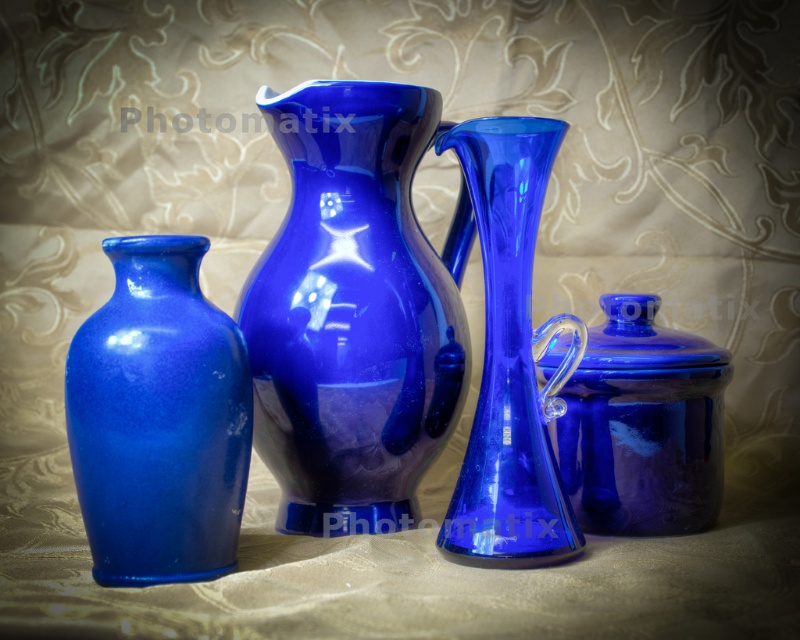
Does glossy ceramic vase at left have a lesser height compared to glossy cobalt blue jar at right?

No, glossy ceramic vase at left is not shorter than glossy cobalt blue jar at right.

Where is `glossy ceramic vase at left`? The image size is (800, 640). glossy ceramic vase at left is located at coordinates (158, 419).

The image size is (800, 640). Identify the location of glossy ceramic vase at left. (158, 419).

Is glossy glass vase at center above glossy cobalt blue jar at right?

Correct, glossy glass vase at center is located above glossy cobalt blue jar at right.

Is point (521, 461) positioned behind point (568, 401)?

That is False.

Who is more distant from viewer, (542, 428) or (680, 428)?

The point (680, 428) is behind.

Identify the location of glossy glass vase at center. The height and width of the screenshot is (640, 800). (512, 358).

Does glossy ceramic jug at center appear over glossy glass vase at center?

Yes, glossy ceramic jug at center is above glossy glass vase at center.

Does glossy ceramic jug at center have a greater height compared to glossy glass vase at center?

Yes, glossy ceramic jug at center is taller than glossy glass vase at center.

Which is in front, point (380, 218) or point (436, 150)?

Positioned in front is point (436, 150).

Where is `glossy ceramic jug at center`? The image size is (800, 640). glossy ceramic jug at center is located at coordinates (354, 310).